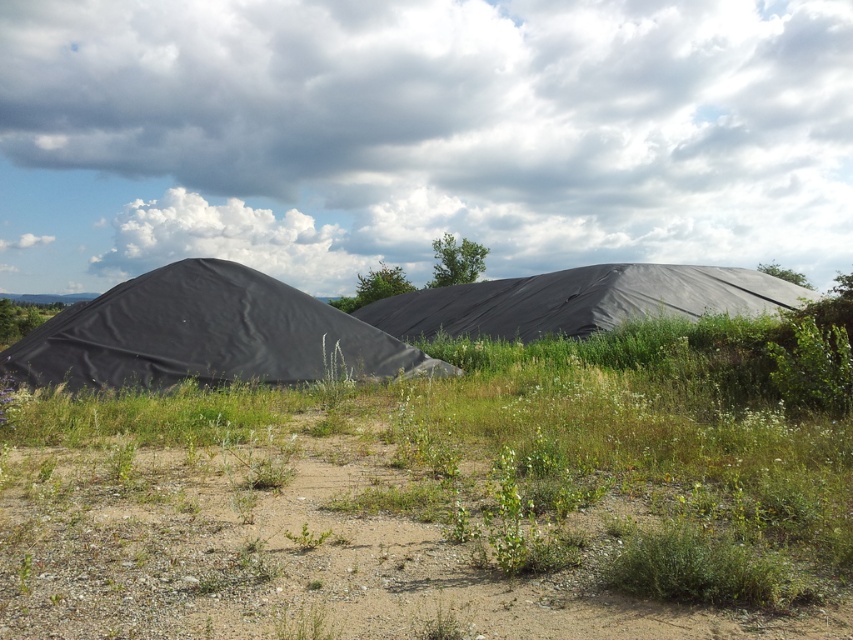
Does black matte tent at left appear on the left side of black tarp at center?

Correct, you'll find black matte tent at left to the left of black tarp at center.

Is point (73, 310) more distant than point (548, 316)?

No.

I want to click on black matte tent at left, so click(206, 336).